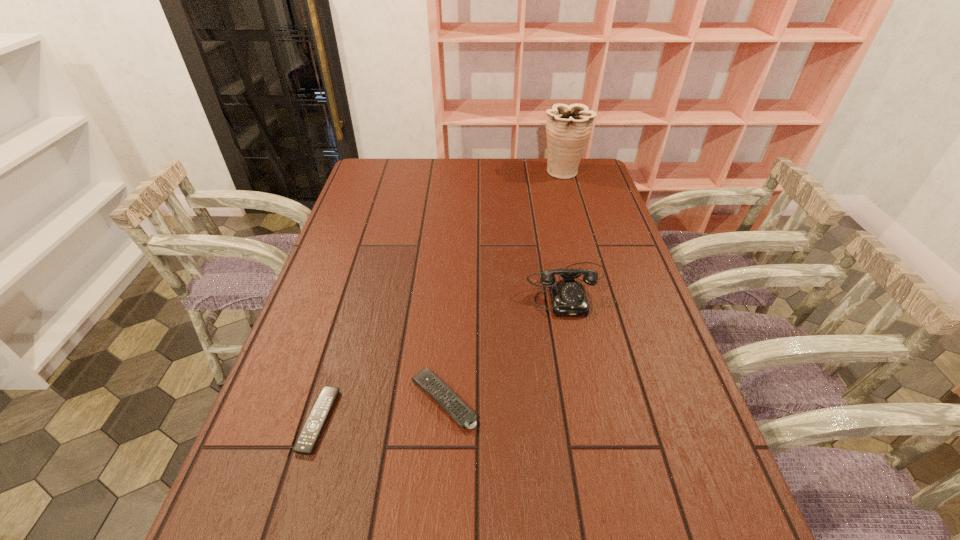
The image size is (960, 540). What are the coordinates of `urn` in the screenshot? It's located at (568, 127).

This screenshot has height=540, width=960. What are the coordinates of `the tallest object` in the screenshot? It's located at (568, 127).

Identify the location of the second tallest object. The width and height of the screenshot is (960, 540). (568, 297).

Where is `telephone`? This screenshot has width=960, height=540. telephone is located at coordinates (568, 297).

Locate an element on the screen. the taller remote control is located at coordinates (427, 380).

Where is `the second shortest object`? This screenshot has width=960, height=540. the second shortest object is located at coordinates (427, 380).

At what (x,y) coordinates should I click in order to perform the action: click on the shorter remote control. Please return your answer as a coordinate pair (x, y). Looking at the image, I should click on (308, 437).

At what (x,y) coordinates should I click in order to perform the action: click on the left remote control. Please return your answer as a coordinate pair (x, y). This screenshot has width=960, height=540. Looking at the image, I should click on pyautogui.click(x=308, y=437).

Where is `vacant space located 0.230m on the front of the farthest object`? The height and width of the screenshot is (540, 960). vacant space located 0.230m on the front of the farthest object is located at coordinates coord(576,217).

Where is `vacant space located 0.240m on the front-facing side of the third nearest object`? vacant space located 0.240m on the front-facing side of the third nearest object is located at coordinates (591, 399).